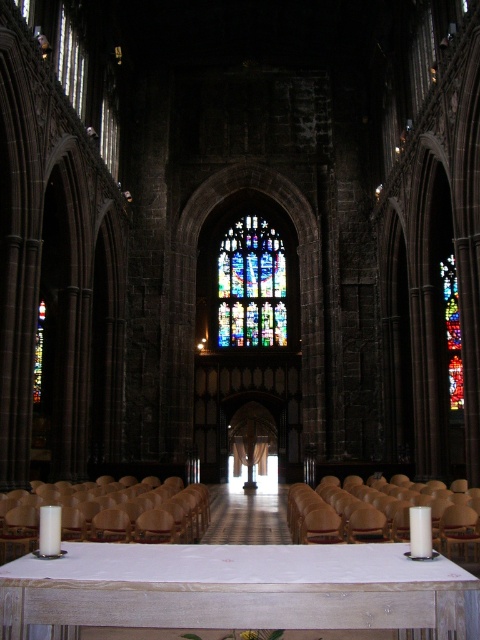
Is point (446, 305) positioned in front of point (422, 534)?

No, it is not.

How far apart are multicolored stained glass at right and white matte candle at center?

A distance of 74.10 meters exists between multicolored stained glass at right and white matte candle at center.

Describe the element at coordinates (453, 332) in the screenshot. I see `multicolored stained glass at right` at that location.

This screenshot has height=640, width=480. Identify the location of multicolored stained glass at right. (453, 332).

Describe the element at coordinates (343, 515) in the screenshot. I see `brown leather chair at lower center` at that location.

Can you confirm if brown leather chair at lower center is bigger than white wax candle at lower left?

Yes, brown leather chair at lower center is bigger than white wax candle at lower left.

The image size is (480, 640). Describe the element at coordinates (343, 515) in the screenshot. I see `brown leather chair at lower center` at that location.

This screenshot has width=480, height=640. I want to click on brown leather chair at lower center, so click(x=343, y=515).

Which is in front, point (195, 486) or point (420, 554)?

Point (420, 554) is in front.

Between brown wood chair at lower center and white matte candle at center, which one appears on the right side from the viewer's perspective?

Positioned to the right is white matte candle at center.

Where is `brown wood chair at lower center`? brown wood chair at lower center is located at coordinates (141, 516).